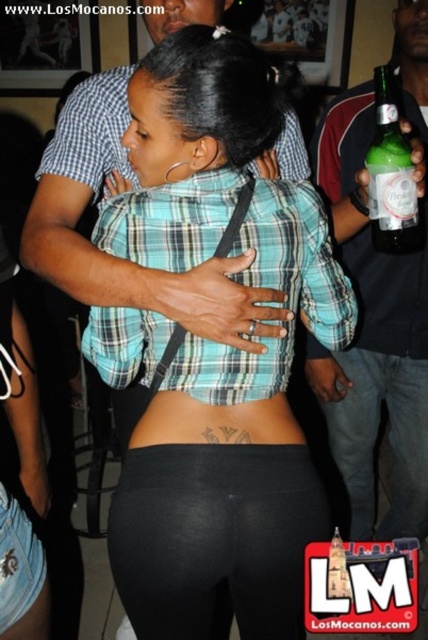
You are standing in the party scene and want to take a photo of both the matte plaid shirt at center and the plaid fabric shirt at upper center. Which one should you focus on first to ensure both are in clear view?

You should focus on the matte plaid shirt at center first since it is closer to the viewer than the plaid fabric shirt at upper center. By focusing on the closer object, the farther one may still be in focus due to depth of field.

In the scene described, there are two plaid shirts visible. The matte plaid shirt at center and the plaid fabric shirt at upper center. From the perspective of someone standing in front of the scene, which plaid shirt is positioned more to the right?

The matte plaid shirt at center is positioned to the right of the plaid fabric shirt at upper center, so the matte plaid shirt at center is more to the right.